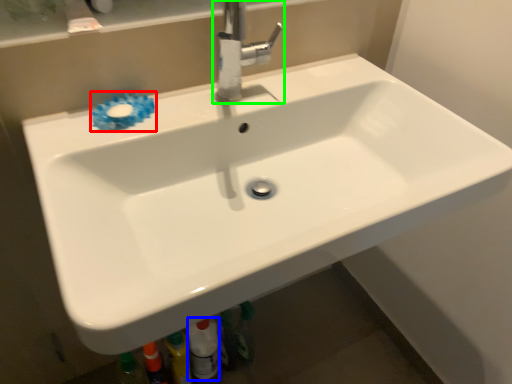
Question: Based on their relative distances, which object is farther from flower (highlighted by a red box)? Choose from toiletry (highlighted by a blue box) and tap (highlighted by a green box).

Choices:
 (A) toiletry
 (B) tap

Answer: (A)